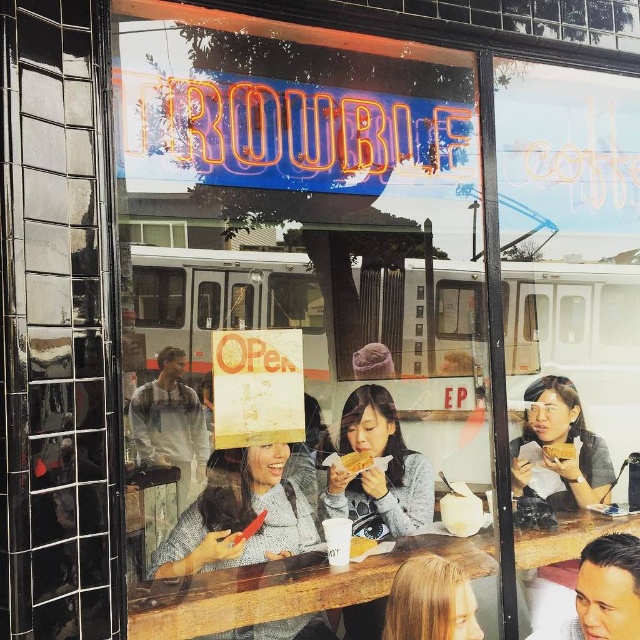
Does light gray sweater at center have a lesser width compared to matte white bread at center?

Incorrect, light gray sweater at center's width is not less than matte white bread at center's.

You are a GUI agent. You are given a task and a screenshot of the screen. Output one action in this format:
    pyautogui.click(x=<x>, y=<y>)
    Task: Click on the light gray sweater at center
    The height and width of the screenshot is (640, 640).
    Given the screenshot: What is the action you would take?
    pyautogui.click(x=170, y=424)

Does point (150, 449) come in front of point (384, 630)?

Yes, point (150, 449) is in front of point (384, 630).

Is point (179, 474) positioned behind point (460, 580)?

No, it is not.

Locate an element on the screen. This screenshot has height=640, width=640. light gray sweater at center is located at coordinates (170, 424).

Is matte gray shirt at right to the left of light gray sweater at center from the viewer's perspective?

In fact, matte gray shirt at right is to the right of light gray sweater at center.

Does matte gray shirt at right have a greater width compared to light gray sweater at center?

Indeed, matte gray shirt at right has a greater width compared to light gray sweater at center.

Who is more forward, (561, 394) or (182, 452)?

Point (182, 452)

Image resolution: width=640 pixels, height=640 pixels. Find the location of `matte gray shirt at right`. matte gray shirt at right is located at coordinates pyautogui.click(x=560, y=442).